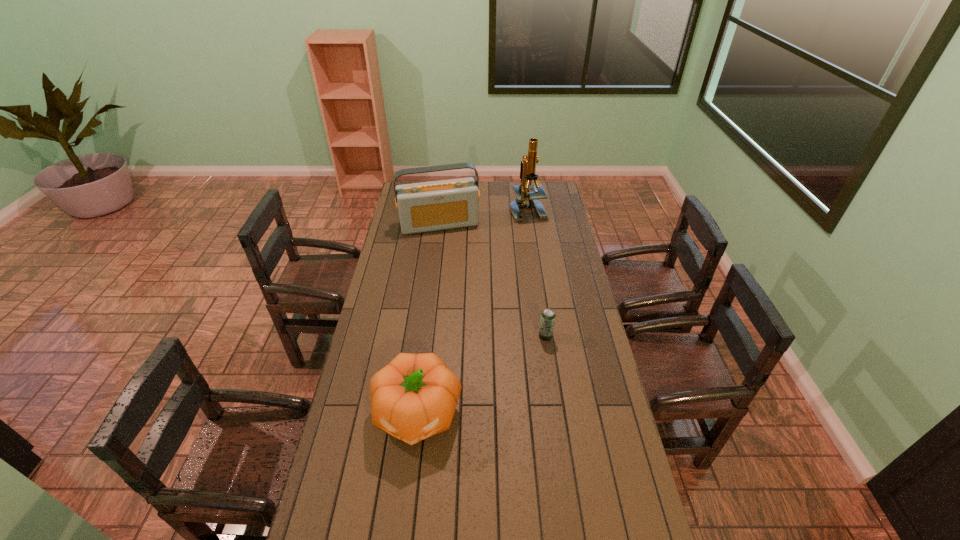
Where is `vacant area between the shortest object and the microscope`? This screenshot has width=960, height=540. vacant area between the shortest object and the microscope is located at coordinates [537, 273].

Locate an element on the screen. This screenshot has height=540, width=960. unoccupied position between the third tallest object and the third farthest object is located at coordinates (481, 375).

This screenshot has height=540, width=960. I want to click on free space between the third farthest object and the radio receiver, so click(x=492, y=280).

I want to click on vacant space in between the shortest object and the third tallest object, so click(x=481, y=375).

The image size is (960, 540). I want to click on empty space between the tallest object and the shortest object, so click(x=537, y=273).

Identify which object is located as the second nearest to the nearest object. Please provide its 2D coordinates. Your answer should be formatted as a tuple, i.e. [(x, y)], where the tuple contains the x and y coordinates of a point satisfying the conditions above.

[(437, 205)]

Point out which object is positioned as the nearest to the second tallest object. Please provide its 2D coordinates. Your answer should be formatted as a tuple, i.e. [(x, y)], where the tuple contains the x and y coordinates of a point satisfying the conditions above.

[(524, 199)]

Where is `vacant area that satisfies the following two spatial constraints: 1. on the back side of the tallest object; 2. on the right side of the beer can`? vacant area that satisfies the following two spatial constraints: 1. on the back side of the tallest object; 2. on the right side of the beer can is located at coordinates (527, 210).